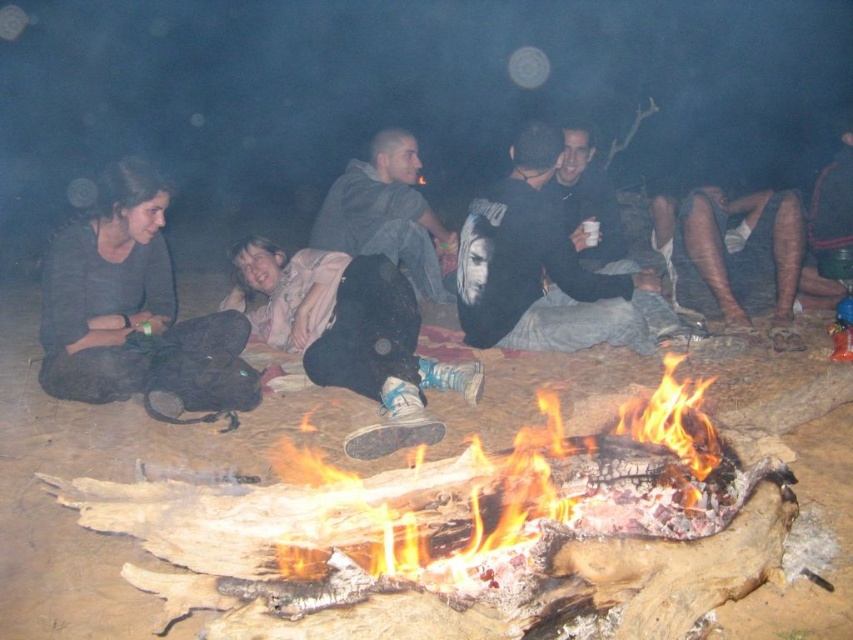
Is charred wood fire at center to the right of pink fabric at center from the viewer's perspective?

Correct, you'll find charred wood fire at center to the right of pink fabric at center.

Describe the element at coordinates (518, 483) in the screenshot. I see `charred wood fire at center` at that location.

This screenshot has height=640, width=853. What are the coordinates of `charred wood fire at center` in the screenshot? It's located at (518, 483).

Measure the distance between brown textured skin at lower right and dark gray hoodie at center.

5.18 feet

Who is more forward, (718, 200) or (368, 188)?

Positioned in front is point (368, 188).

Locate an element on the screen. brown textured skin at lower right is located at coordinates (740, 257).

From the picture: Who is more forward, (659, 429) or (434, 259)?

Point (659, 429) is in front.

Is point (344, 502) positioned behind point (369, 216)?

No.

At what (x,y) coordinates should I click in order to perform the action: click on charred wood fire at center. Please return your answer as a coordinate pair (x, y). The image size is (853, 640). Looking at the image, I should click on click(518, 483).